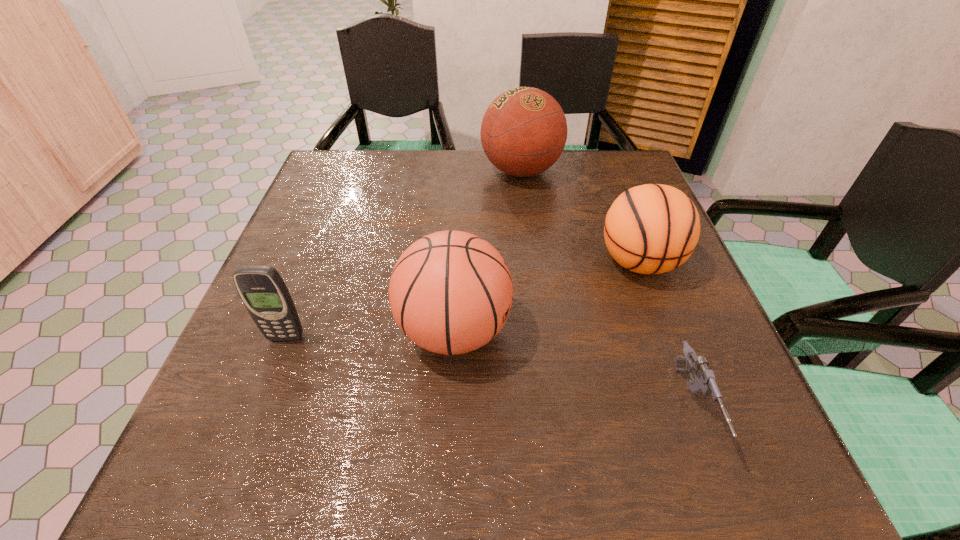
Locate an element on the screen. Image resolution: width=960 pixels, height=540 pixels. free spot between the shortest object and the farthest basketball is located at coordinates (607, 289).

You are a GUI agent. You are given a task and a screenshot of the screen. Output one action in this format:
    pyautogui.click(x=<x>, y=<y>)
    Task: Click on the free space between the gun and the shortest basketball
    
    Given the screenshot: What is the action you would take?
    pyautogui.click(x=665, y=335)

This screenshot has height=540, width=960. Identify the location of free area in between the rightmost basketball and the shortest object. (665, 335).

Identify the location of object that is the fourth closest to the farthest object. (264, 293).

The width and height of the screenshot is (960, 540). I want to click on object that is the second closest to the shortest basketball, so click(523, 133).

Identify the location of basketball identified as the second closest to the rightmost basketball. (451, 292).

Identify which basketball is the nearest to the leftmost object. Please provide its 2D coordinates. Your answer should be formatted as a tuple, i.e. [(x, y)], where the tuple contains the x and y coordinates of a point satisfying the conditions above.

[(451, 292)]

Image resolution: width=960 pixels, height=540 pixels. In order to click on free space that satisfies the following two spatial constraints: 1. on the front side of the farthest object; 2. on the left side of the shortest basketball in this screenshot , I will do `click(532, 262)`.